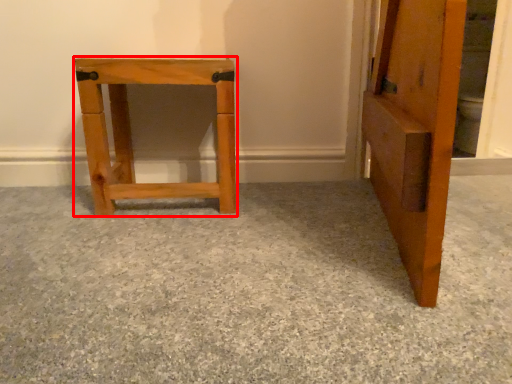
Question: Considering the relative positions of furniture (annotated by the red box) and concrete in the image provided, where is furniture (annotated by the red box) located with respect to the staircase?

Choices:
 (A) left
 (B) right

Answer: (A)